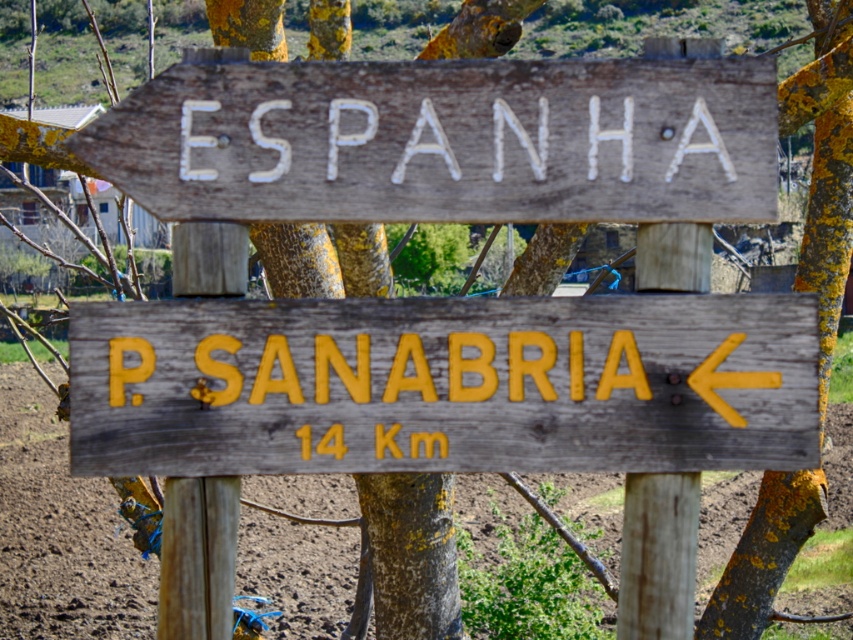
Question: Considering the real-world distances, which object is farthest from the wooden sign at upper center?

Choices:
 (A) yellow painted wood sign at center
 (B) brown soil at lower left

Answer: (B)

Question: In this image, where is yellow painted wood sign at center located relative to wooden sign at upper center?

Choices:
 (A) left
 (B) right

Answer: (B)

Question: Does yellow painted wood sign at center appear under brown soil at lower left?

Choices:
 (A) yes
 (B) no

Answer: (B)

Question: Among these points, which one is farthest from the camera?

Choices:
 (A) (314, 461)
 (B) (503, 488)

Answer: (B)

Question: Can you confirm if yellow painted wood sign at center is smaller than wooden sign at upper center?

Choices:
 (A) yes
 (B) no

Answer: (A)

Question: Which point is farther to the camera?

Choices:
 (A) wooden sign at upper center
 (B) brown soil at lower left
 (C) yellow painted wood sign at center

Answer: (C)